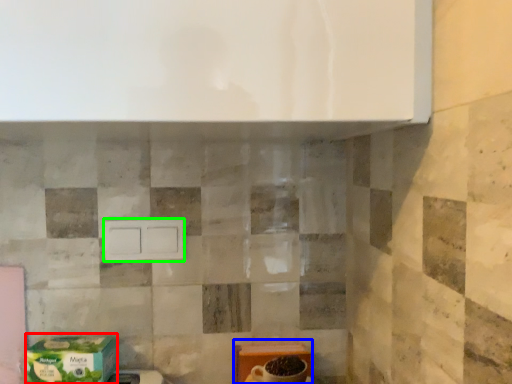
Question: Based on their relative distances, which object is nearer to cardboard box (highlighted by a red box)? Choose from cardboard box (highlighted by a blue box) and drawer (highlighted by a green box).

Choices:
 (A) cardboard box
 (B) drawer

Answer: (B)